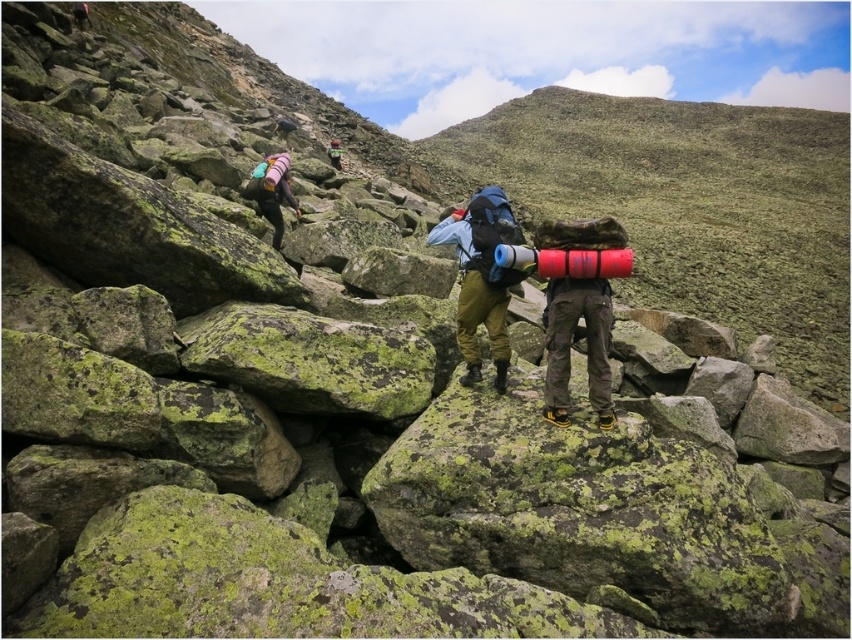
Question: Can you confirm if pink fabric backpack at upper left is positioned below matte pink backpack at upper center?

Choices:
 (A) yes
 (B) no

Answer: (A)

Question: Does green camouflage pants at center have a smaller size compared to matte pink backpack at upper center?

Choices:
 (A) no
 (B) yes

Answer: (B)

Question: Does pink fabric backpack at upper left have a greater width compared to matte pink backpack at upper center?

Choices:
 (A) yes
 (B) no

Answer: (B)

Question: Which of the following is the closest to the observer?

Choices:
 (A) (335, 168)
 (B) (499, 237)

Answer: (B)

Question: Estimate the real-world distances between objects in this image. Which object is farther from the pink fabric backpack at upper left?

Choices:
 (A) green camouflage pants at center
 (B) matte pink backpack at upper center

Answer: (B)

Question: Among these points, which one is nearest to the camera?

Choices:
 (A) (498, 230)
 (B) (272, 237)
 (C) (335, 152)

Answer: (A)